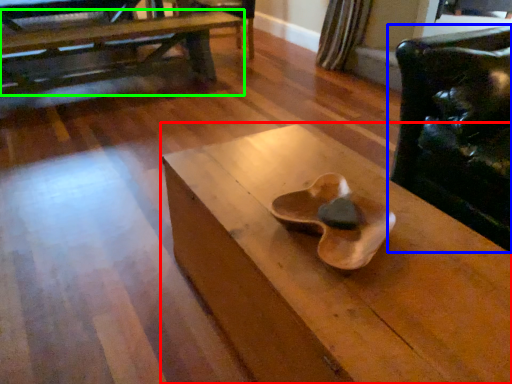
Question: Considering the real-world distances, which object is closest to table (highlighted by a red box)? chair (highlighted by a blue box) or table (highlighted by a green box).

Choices:
 (A) chair
 (B) table

Answer: (A)